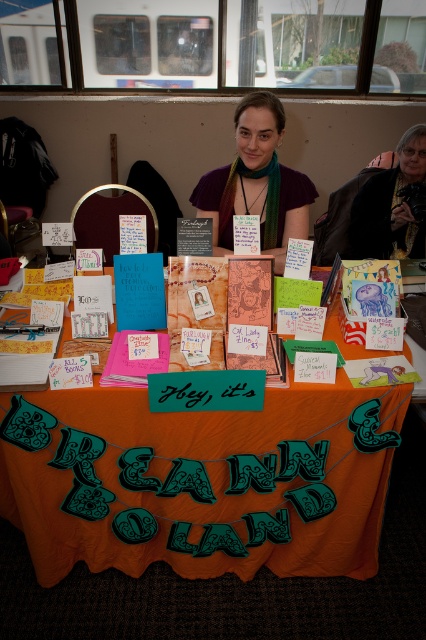
Question: Which point is closer to the camera?

Choices:
 (A) (244, 164)
 (B) (336, 381)

Answer: (B)

Question: Which of these objects is positioned farthest from the dark brown leather jacket at upper right?

Choices:
 (A) green knitted scarf at center
 (B) orange fabric at center

Answer: (B)

Question: Considering the relative positions of green knitted scarf at center and dark brown leather jacket at upper right in the image provided, where is green knitted scarf at center located with respect to dark brown leather jacket at upper right?

Choices:
 (A) above
 (B) below

Answer: (B)

Question: Which object is the closest to the green knitted scarf at center?

Choices:
 (A) dark brown leather jacket at upper right
 (B) orange fabric at center

Answer: (A)

Question: Is green knitted scarf at center to the left of dark brown leather jacket at upper right from the viewer's perspective?

Choices:
 (A) no
 (B) yes

Answer: (B)

Question: Does green knitted scarf at center appear under dark brown leather jacket at upper right?

Choices:
 (A) no
 (B) yes

Answer: (B)